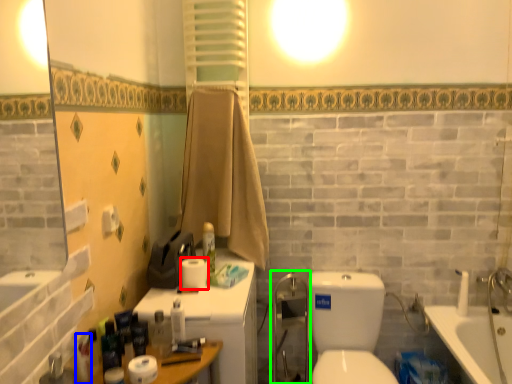
Question: Estimate the real-world distances between objects in this image. Which object is closer to toilet paper (highlighted by a red box), toiletry (highlighted by a blue box) or shower door (highlighted by a green box)?

Choices:
 (A) toiletry
 (B) shower door

Answer: (A)